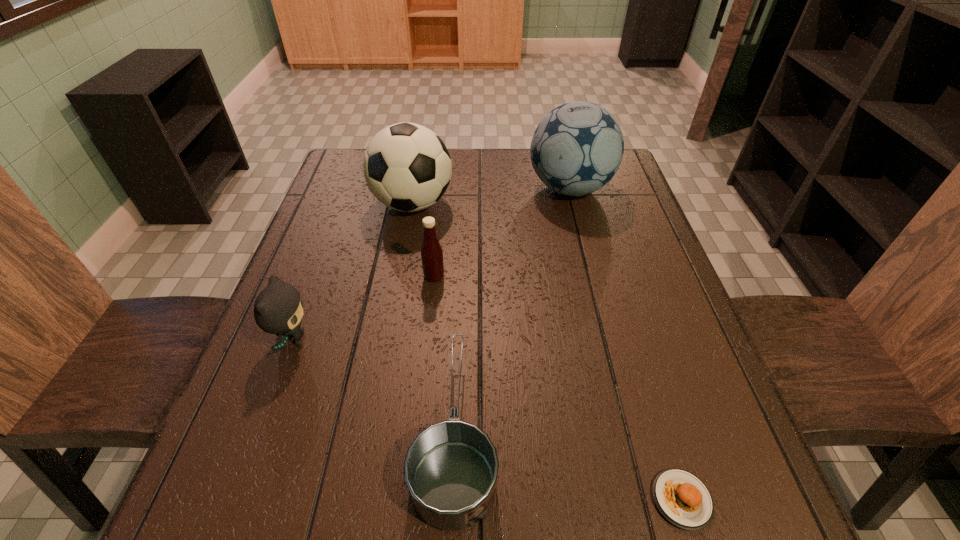
Where is `soccer ball that is at the right edge`? This screenshot has height=540, width=960. soccer ball that is at the right edge is located at coordinates (577, 148).

What are the coordinates of `food situated at the right edge` in the screenshot? It's located at (682, 498).

You are a GUI agent. You are given a task and a screenshot of the screen. Output one action in this format:
    pyautogui.click(x=<x>, y=<y>)
    Task: Click on the object that is at the far left corner
    
    Given the screenshot: What is the action you would take?
    pyautogui.click(x=407, y=167)

Find the location of a particular element. object that is at the far right corner is located at coordinates (577, 148).

The width and height of the screenshot is (960, 540). I want to click on object that is at the near right corner, so click(x=682, y=498).

In the image, there is a desktop. Identify the location of vacant space at the far edge. This screenshot has height=540, width=960. (497, 173).

Find the location of a particular element. The image size is (960, 540). vacant region at the near edge is located at coordinates (623, 529).

In order to click on free space at the left edge of the desktop in this screenshot , I will do `click(261, 379)`.

Identify the location of free space at the right edge. (647, 264).

Locate an element on the screen. The width and height of the screenshot is (960, 540). free space at the far left corner of the desktop is located at coordinates (330, 188).